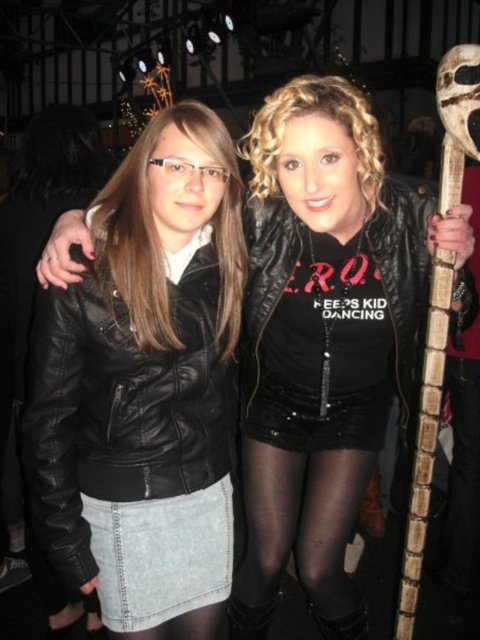
Question: Does matte black jacket at left come in front of denim skirt at lower left?

Choices:
 (A) yes
 (B) no

Answer: (A)

Question: Can you confirm if black leather jacket at left is positioned below matte black leather jacket at center?

Choices:
 (A) yes
 (B) no

Answer: (A)

Question: Does matte black jacket at left have a greater width compared to matte black leather jacket at center?

Choices:
 (A) yes
 (B) no

Answer: (B)

Question: Which object is farther from the camera taking this photo?

Choices:
 (A) matte black leather jacket at center
 (B) matte black jacket at left

Answer: (A)

Question: Which point is farther to the camera?

Choices:
 (A) black leather jacket at left
 (B) matte black jacket at left
 (C) denim skirt at lower left
 (D) matte black leather jacket at center

Answer: (C)

Question: Among these points, which one is nearest to the camera?

Choices:
 (A) (143, 502)
 (B) (160, 330)
 (C) (168, 328)

Answer: (C)